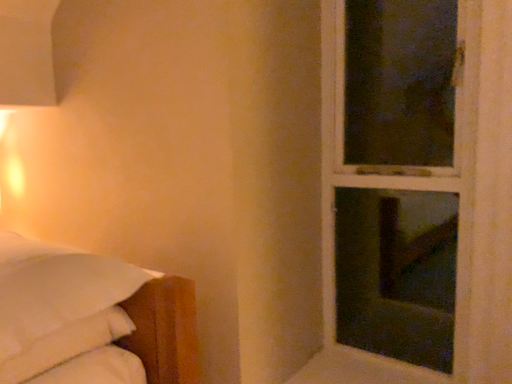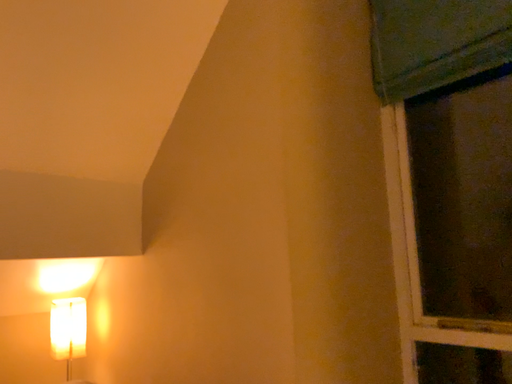
Question: How did the camera likely rotate when shooting the video?

Choices:
 (A) rotated left
 (B) rotated right

Answer: (A)